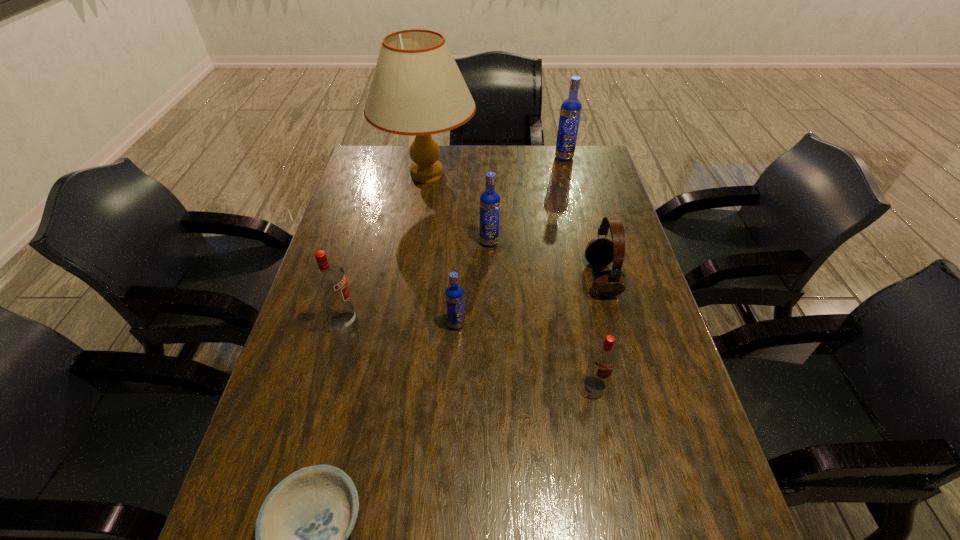
Where is `object that is at the far right corner`? This screenshot has height=540, width=960. object that is at the far right corner is located at coordinates (571, 108).

Identify the location of free space at the far edge of the desktop. (521, 156).

At what (x,y) coordinates should I click in order to perform the action: click on free space at the left edge of the desktop. Please return your answer as a coordinate pair (x, y). The height and width of the screenshot is (540, 960). Looking at the image, I should click on (335, 235).

Identify the location of free location at the right edge. (594, 271).

I want to click on free spot at the far left corner of the desktop, so click(379, 169).

At what (x,y) coordinates should I click in order to perform the action: click on unoccupied position between the second nearest object and the second blue vodka from right to left. Please return your answer as a coordinate pair (x, y). The image size is (960, 540). Looking at the image, I should click on (541, 314).

This screenshot has height=540, width=960. I want to click on blank region between the left red vodka and the biggest blue vodka, so click(x=454, y=240).

This screenshot has width=960, height=540. I want to click on vacant region between the tallest vodka and the left red vodka, so click(x=454, y=240).

What are the coordinates of `free space between the fourth farthest object and the lampshade` in the screenshot? It's located at (515, 226).

In order to click on vacant region between the biggest blue vodka and the tallest object in this screenshot , I will do `click(495, 166)`.